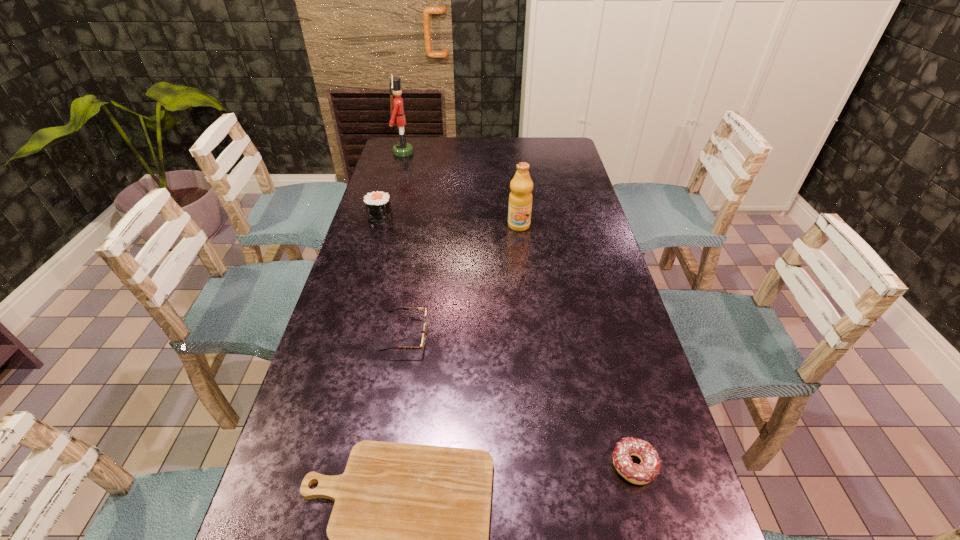
You are a GUI agent. You are given a task and a screenshot of the screen. Output one action in this format:
    pyautogui.click(x=<x>, y=<y>)
    Task: Click on the farthest object
    This screenshot has width=960, height=540.
    Given the screenshot: What is the action you would take?
    pyautogui.click(x=402, y=149)

Find the location of a particular element. nutcracker is located at coordinates (402, 149).

You are a GUI agent. You are given a task and a screenshot of the screen. Output one action in this format:
    pyautogui.click(x=<x>, y=<y>)
    Task: Click on the second object from right to left
    The image size is (960, 540).
    Given the screenshot: What is the action you would take?
    pyautogui.click(x=520, y=198)

The width and height of the screenshot is (960, 540). I want to click on fruit juice, so click(520, 198).

Identify the location of sushi. The image size is (960, 540). (378, 207).

Locate an element on the screen. The height and width of the screenshot is (540, 960). spectacles is located at coordinates (423, 343).

Find the location of `doughnut`. doughnut is located at coordinates click(x=649, y=468).

The width and height of the screenshot is (960, 540). What are the coordinates of `vacant space situated on the front-facing side of the nutcracker` in the screenshot? It's located at (458, 152).

I want to click on vacant space situated 0.170m on the front label of the fruit juice, so point(523,264).

Where is `free space located on the back of the fourth shortest object`? The width and height of the screenshot is (960, 540). free space located on the back of the fourth shortest object is located at coordinates (388, 188).